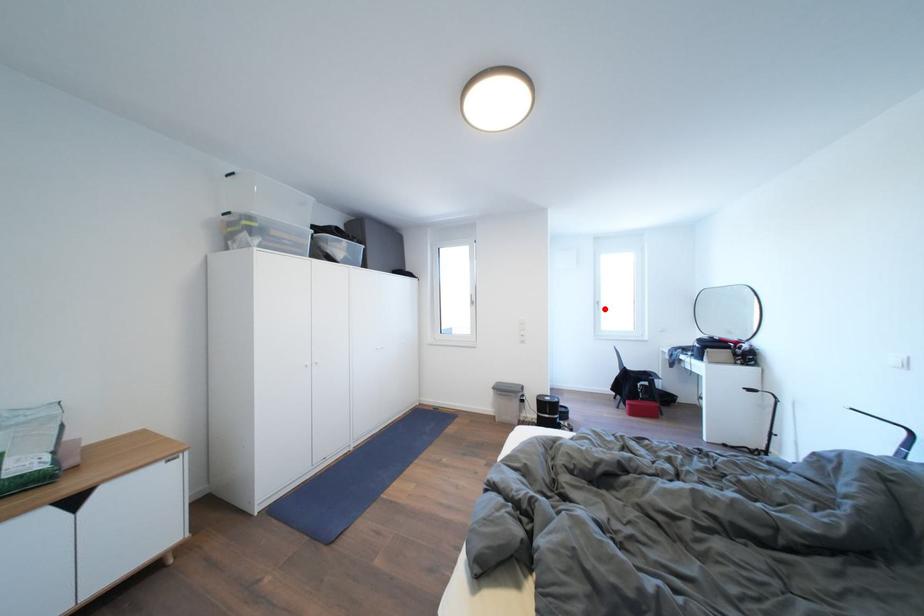
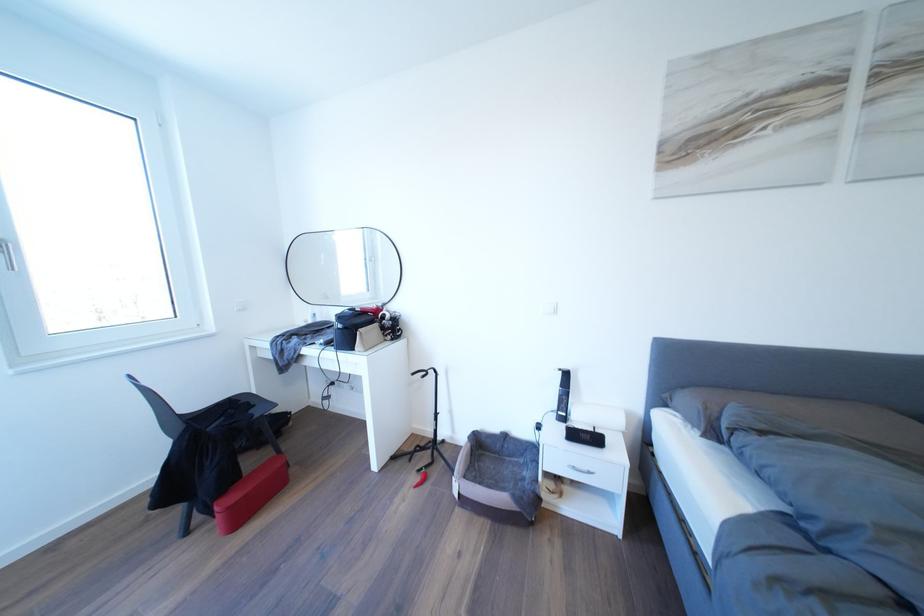
Find the pixel in the second image that matches the highlighted location in the first image.

(6, 254)